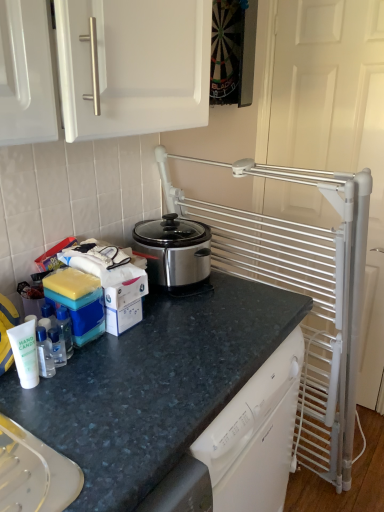
I want to click on vacant space to the right of clear plastic bottle at lower left, marked as the second bottle in a front-to-back arrangement, so click(94, 396).